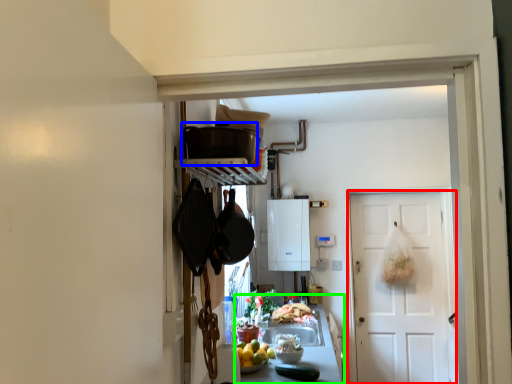
Question: Which is farther away from door (highlighted by a red box)? appliance (highlighted by a blue box) or counter top (highlighted by a green box)?

Choices:
 (A) appliance
 (B) counter top

Answer: (A)